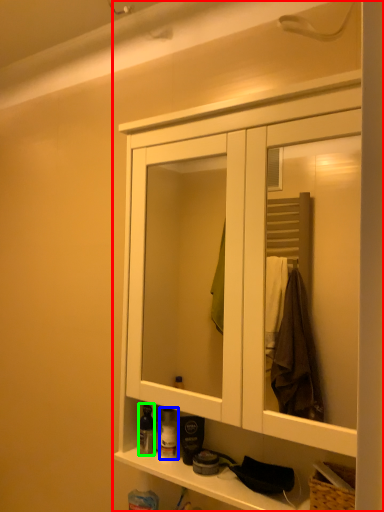
Question: Considering the real-world distances, which object is farthest from cabinetry (highlighted by a red box)? toiletry (highlighted by a blue box) or toiletry (highlighted by a green box)?

Choices:
 (A) toiletry
 (B) toiletry

Answer: (A)